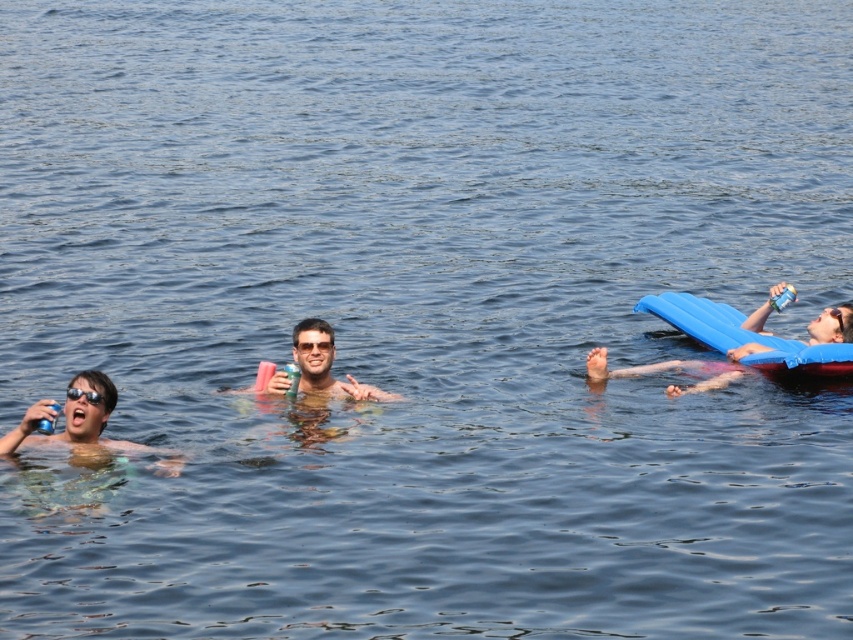
Measure the distance between point (322, 342) and camera.

A distance of 21.66 meters exists between point (322, 342) and camera.

The height and width of the screenshot is (640, 853). Find the location of `matte plastic can at center`. matte plastic can at center is located at coordinates (326, 364).

Consider the image. Does blue foam mattress at right have a larger size compared to black plastic goggles at upper left?

Indeed, blue foam mattress at right has a larger size compared to black plastic goggles at upper left.

Does blue foam mattress at right lie in front of black plastic goggles at upper left?

No, it is not.

Identify the location of blue foam mattress at right. (738, 340).

Measure the distance between point (701,340) and camera.

Point (701,340) and camera are 26.39 meters apart from each other.

Is blue foam mattress at right behind matte plastic can at center?

Yes, blue foam mattress at right is behind matte plastic can at center.

At what (x,y) coordinates should I click in order to perform the action: click on blue foam mattress at right. Please return your answer as a coordinate pair (x, y). This screenshot has width=853, height=640. Looking at the image, I should click on (738, 340).

Where is `blue foam mattress at right`? blue foam mattress at right is located at coordinates (738, 340).